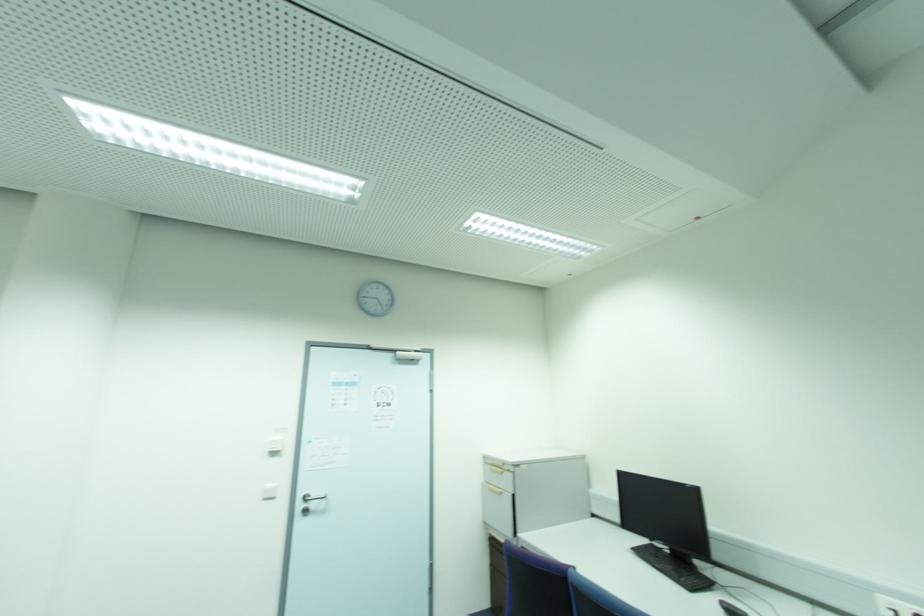
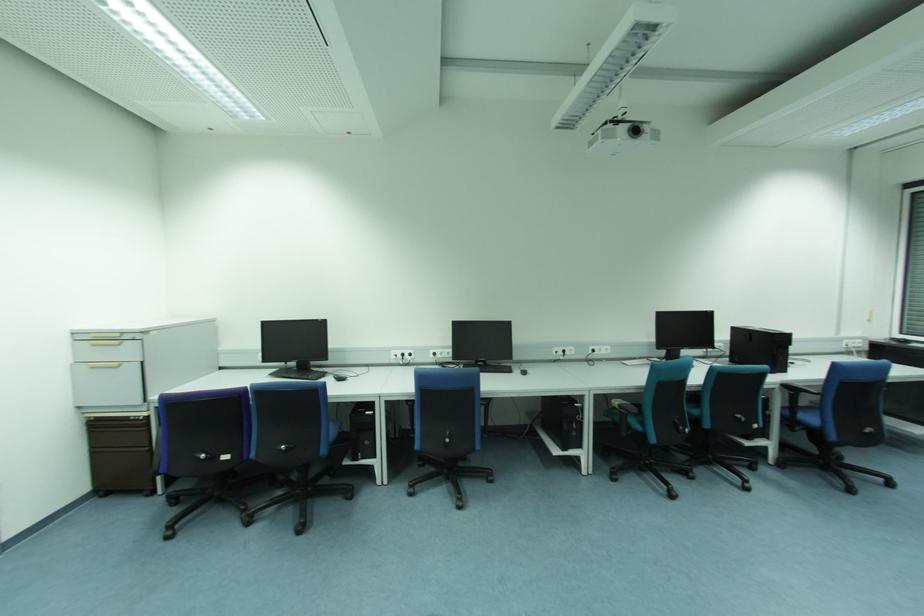
Question: The first image is from the beginning of the video and the second image is from the end. How did the camera likely rotate when shooting the video?

Choices:
 (A) Left
 (B) Right
 (C) Up
 (D) Down

Answer: (B)